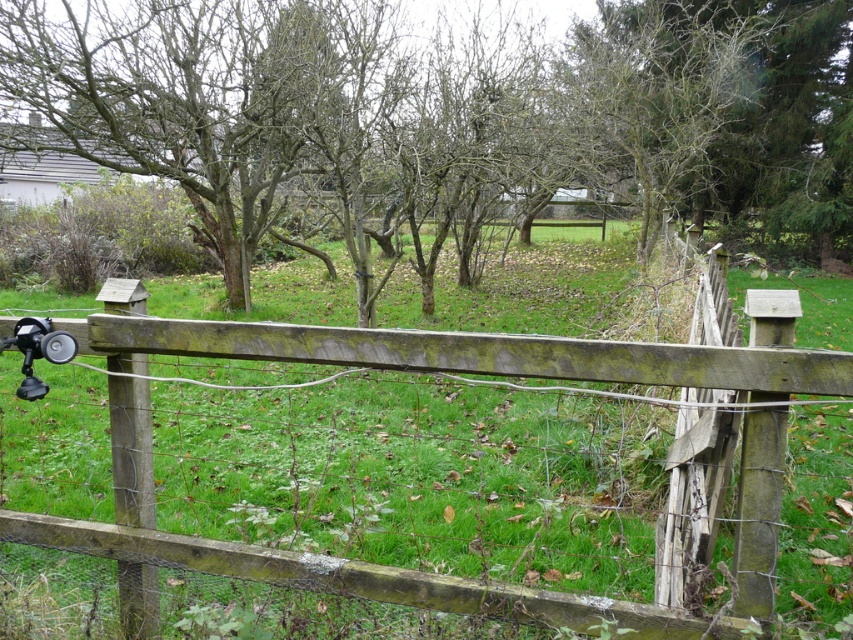
Question: From the image, what is the correct spatial relationship of brown wood tree at center in relation to matte black camera at lower left?

Choices:
 (A) right
 (B) left

Answer: (A)

Question: Can you confirm if brown wood tree at center is smaller than matte black camera at lower left?

Choices:
 (A) no
 (B) yes

Answer: (A)

Question: Does brown wood tree at center have a greater width compared to matte black camera at lower left?

Choices:
 (A) no
 (B) yes

Answer: (B)

Question: Which of the following is the farthest from the observer?

Choices:
 (A) brown wood tree at center
 (B) matte black camera at lower left

Answer: (A)

Question: Estimate the real-world distances between objects in this image. Which object is closer to the matte black camera at lower left?

Choices:
 (A) weathered wood fence at center
 (B) brown wood tree at center

Answer: (A)

Question: Which of these objects is positioned closest to the matte black camera at lower left?

Choices:
 (A) weathered wood fence at center
 (B) brown wood tree at center

Answer: (A)